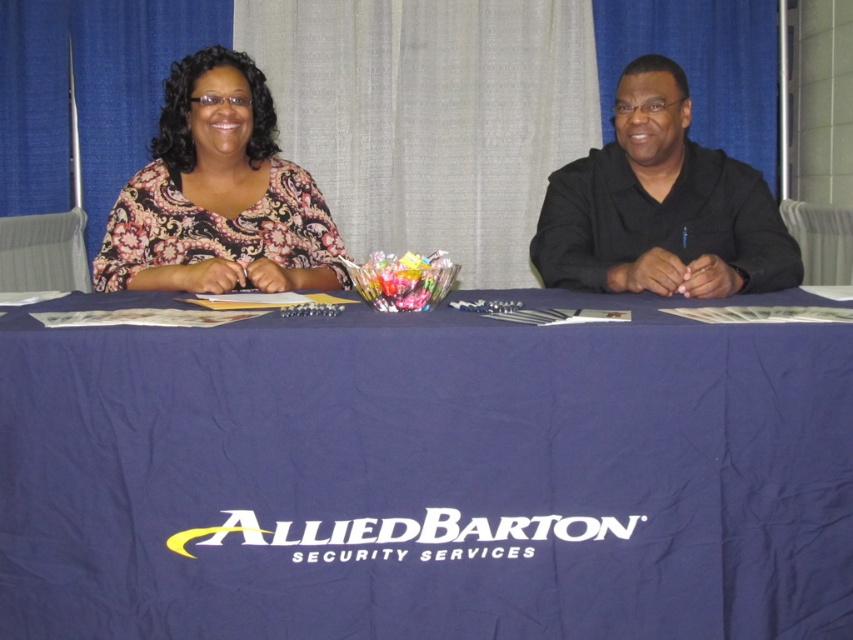
You are a photographer setting up for a portrait. You need to ensure that the navy blue fabric at center and the black matte shirt at right are both visible in the frame. Based on their positions, which object should you focus on first to ensure both are in focus?

The navy blue fabric at center is in front of the black matte shirt at right, so you should focus on the navy blue fabric at center first to ensure both are in focus.

You are a photographer setting up a shoot and notice the navy blue fabric at center and the black matte shirt at right in the frame. Which object appears shorter in height when viewed from your position?

The navy blue fabric at center appears shorter in height than the black matte shirt at right because it is not as tall as the shirt.